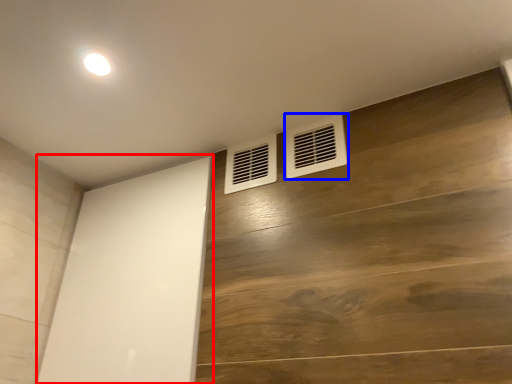
Question: Which object appears farthest to the camera in this image, screen door (highlighted by a red box) or air conditioning (highlighted by a blue box)?

Choices:
 (A) screen door
 (B) air conditioning

Answer: (B)